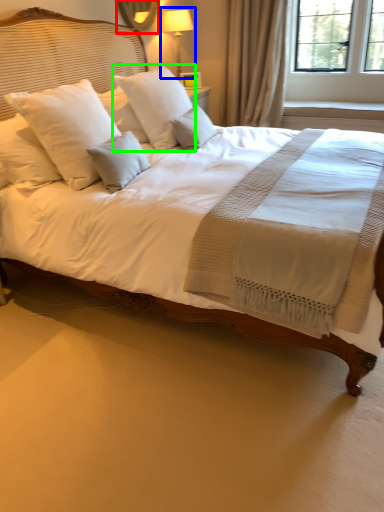
Question: Which is nearer to the mirror (highlighted by a red box)? bedside lamp (highlighted by a blue box) or pillow (highlighted by a green box).

Choices:
 (A) bedside lamp
 (B) pillow

Answer: (A)